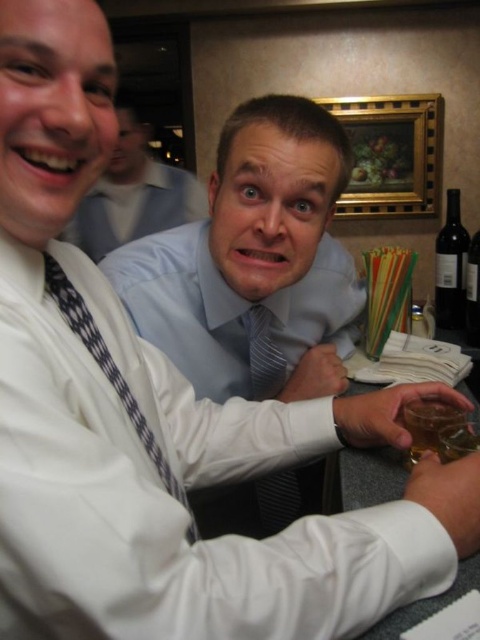
Is blue striped tie at center to the left of translucent glass at lower right from the viewer's perspective?

Indeed, blue striped tie at center is positioned on the left side of translucent glass at lower right.

Is blue striped tie at center bigger than translucent glass at lower right?

Correct, blue striped tie at center is larger in size than translucent glass at lower right.

Image resolution: width=480 pixels, height=640 pixels. Identify the location of blue striped tie at center. (254, 262).

Is the position of smooth gray table at lower right less distant than that of dark glass bottle at right?

Yes, smooth gray table at lower right is closer to the viewer.

Is smooth gray table at lower right smaller than dark glass bottle at right?

No, smooth gray table at lower right is not smaller than dark glass bottle at right.

Is point (451, 602) closer to camera compared to point (468, 333)?

Yes, point (451, 602) is in front of point (468, 333).

The width and height of the screenshot is (480, 640). What are the coordinates of `smooth gray table at lower right` in the screenshot? It's located at (371, 476).

Can you confirm if striped fabric tie at center is positioned to the right of dark glass bottle at upper right?

Incorrect, striped fabric tie at center is not on the right side of dark glass bottle at upper right.

Between point (265, 360) and point (441, 241), which one is positioned behind?

The point (441, 241) is more distant.

Locate an element on the screen. Image resolution: width=480 pixels, height=640 pixels. striped fabric tie at center is located at coordinates (264, 355).